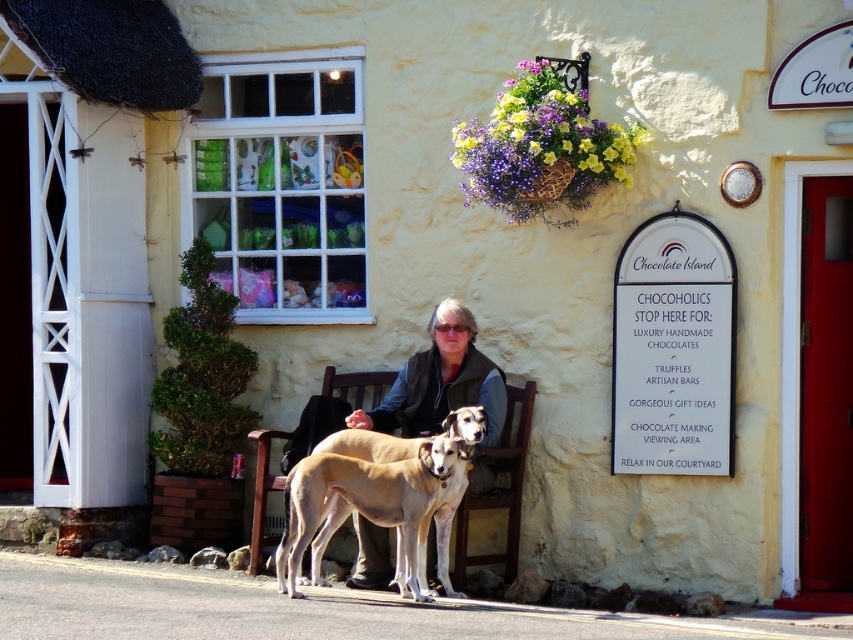
You are planning to bring a small dog to the Chocolate Island store. The store has a policy that allows dogs only if they are smaller than the brown wooden bench at center. Based on the scene description, can the dog with light brown fur at center enter?

The light brown fur at center has a larger size compared to the brown wooden bench at center, so the dog with light brown fur at center cannot enter since it is bigger than the required size limit.

You are a tailor who needs to place a matte black jacket at center onto a brown wooden bench at center. Based on the scene, will the jacket fit on the bench without overlapping the edges?

The matte black jacket at center has a larger width than the brown wooden bench at center, so placing the jacket on the bench would cause it to overlap the edges since it is wider than the bench.